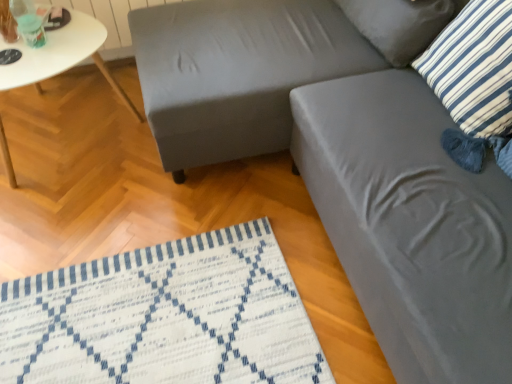
Question: Is blue and white striped pillow at upper right, positioned as the second pillow in back-to-front order, located outside matte gray swivel chair at center, acting as the second swivel chair starting from the top?

Choices:
 (A) yes
 (B) no

Answer: (B)

Question: Is blue and white striped pillow at upper right, acting as the first pillow starting from the front, surrounding matte gray swivel chair at center, acting as the second swivel chair starting from the top?

Choices:
 (A) no
 (B) yes

Answer: (A)

Question: Does blue and white striped pillow at upper right, positioned as the second pillow in back-to-front order, appear on the left side of matte gray swivel chair at center, arranged as the 1th swivel chair when ordered from the bottom?

Choices:
 (A) no
 (B) yes

Answer: (A)

Question: Considering the relative sizes of blue and white striped pillow at upper right, acting as the first pillow starting from the front, and matte gray swivel chair at center, arranged as the 1th swivel chair when ordered from the bottom, in the image provided, is blue and white striped pillow at upper right, acting as the first pillow starting from the front, taller than matte gray swivel chair at center, arranged as the 1th swivel chair when ordered from the bottom,?

Choices:
 (A) yes
 (B) no

Answer: (B)

Question: Does blue and white striped pillow at upper right, acting as the first pillow starting from the front, have a greater width compared to matte gray swivel chair at center, arranged as the 1th swivel chair when ordered from the bottom?

Choices:
 (A) yes
 (B) no

Answer: (B)

Question: In the image, is matte gray swivel chair at upper right, the first swivel chair positioned from the top, positioned in front of or behind matte gray swivel chair at center, acting as the second swivel chair starting from the top?

Choices:
 (A) front
 (B) behind

Answer: (B)

Question: Is point (233, 77) closer or farther from the camera than point (434, 238)?

Choices:
 (A) farther
 (B) closer

Answer: (A)

Question: In terms of height, does matte gray swivel chair at upper right, the first swivel chair positioned from the top, look taller or shorter compared to matte gray swivel chair at center, acting as the second swivel chair starting from the top?

Choices:
 (A) tall
 (B) short

Answer: (B)

Question: In the image, is matte gray swivel chair at upper right, acting as the 2th swivel chair starting from the bottom, on the left side or the right side of matte gray swivel chair at center, arranged as the 1th swivel chair when ordered from the bottom?

Choices:
 (A) left
 (B) right

Answer: (A)

Question: In the image, is matte gray swivel chair at upper right, the first swivel chair positioned from the top, positioned in front of or behind white glossy table at left?

Choices:
 (A) front
 (B) behind

Answer: (A)

Question: Is matte gray swivel chair at upper right, the first swivel chair positioned from the top, wider or thinner than white glossy table at left?

Choices:
 (A) wide
 (B) thin

Answer: (A)

Question: Does point (214, 67) appear closer or farther from the camera than point (52, 36)?

Choices:
 (A) farther
 (B) closer

Answer: (B)

Question: From a real-world perspective, relative to white glossy table at left, is matte gray swivel chair at upper right, the first swivel chair positioned from the top, vertically above or below?

Choices:
 (A) below
 (B) above

Answer: (B)

Question: From their relative heights in the image, would you say white glossy table at left is taller or shorter than blue striped pillow at upper right, the 1th pillow viewed from the back?

Choices:
 (A) short
 (B) tall

Answer: (B)

Question: From the image's perspective, is white glossy table at left above or below blue striped pillow at upper right, the 1th pillow viewed from the back?

Choices:
 (A) above
 (B) below

Answer: (B)